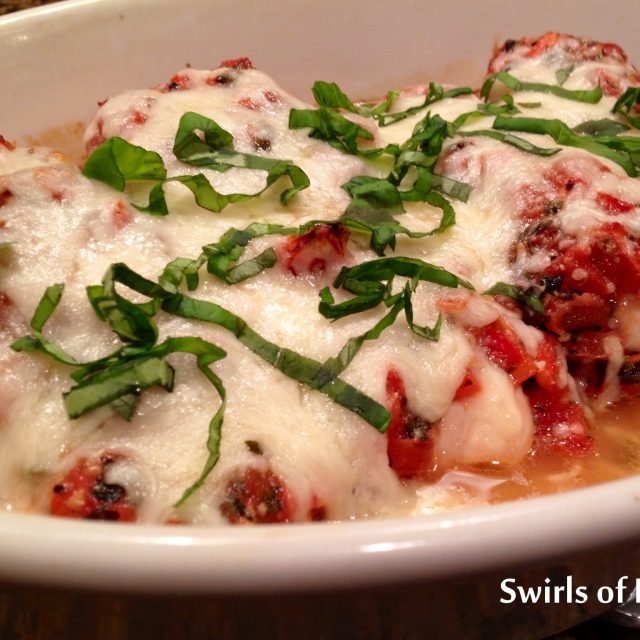
Where is `bowl`? Image resolution: width=640 pixels, height=640 pixels. bowl is located at coordinates (496, 524).